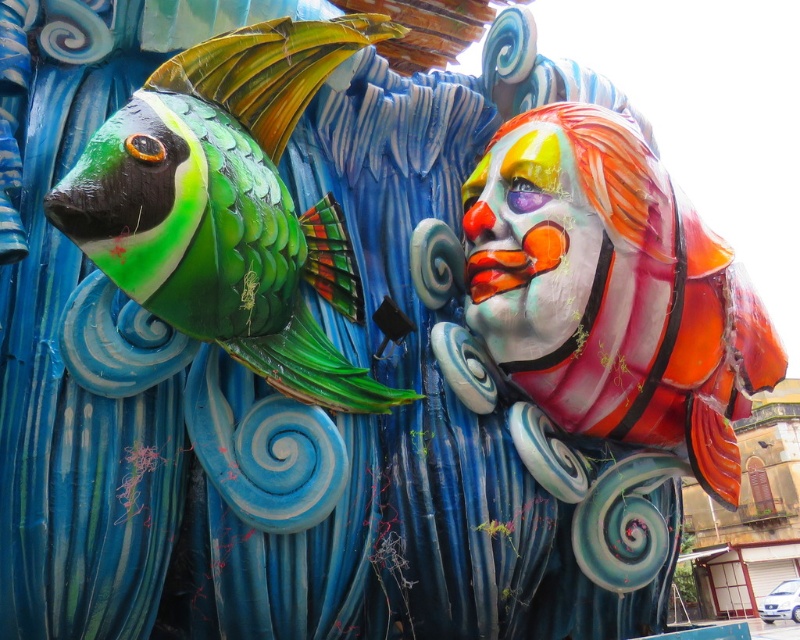
Question: Which point is closer to the camera?

Choices:
 (A) (244, 193)
 (B) (768, 324)
 (C) (508, 204)

Answer: (A)

Question: Does shiny orange fish at right come in front of matte clown face at right?

Choices:
 (A) no
 (B) yes

Answer: (B)

Question: Which object is positioned farthest from the shiny orange fish at right?

Choices:
 (A) matte painted clown head at right
 (B) matte clown face at right

Answer: (A)

Question: Among these objects, which one is nearest to the camera?

Choices:
 (A) matte painted clown head at right
 (B) matte clown face at right

Answer: (A)

Question: Does matte painted clown head at right have a smaller size compared to matte clown face at right?

Choices:
 (A) yes
 (B) no

Answer: (B)

Question: From the image, what is the correct spatial relationship of shiny orange fish at right in relation to matte painted clown head at right?

Choices:
 (A) left
 (B) right

Answer: (B)